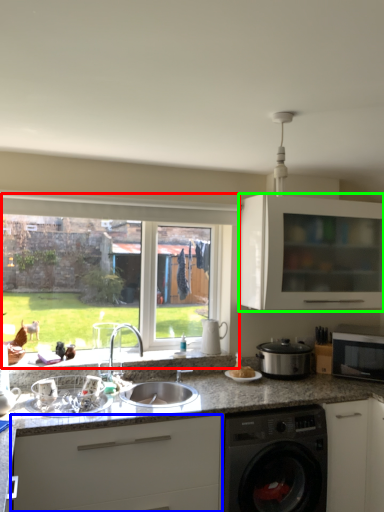
Question: Which is farther away from window (highlighted by a red box)? cabinetry (highlighted by a blue box) or cabinetry (highlighted by a green box)?

Choices:
 (A) cabinetry
 (B) cabinetry

Answer: (A)